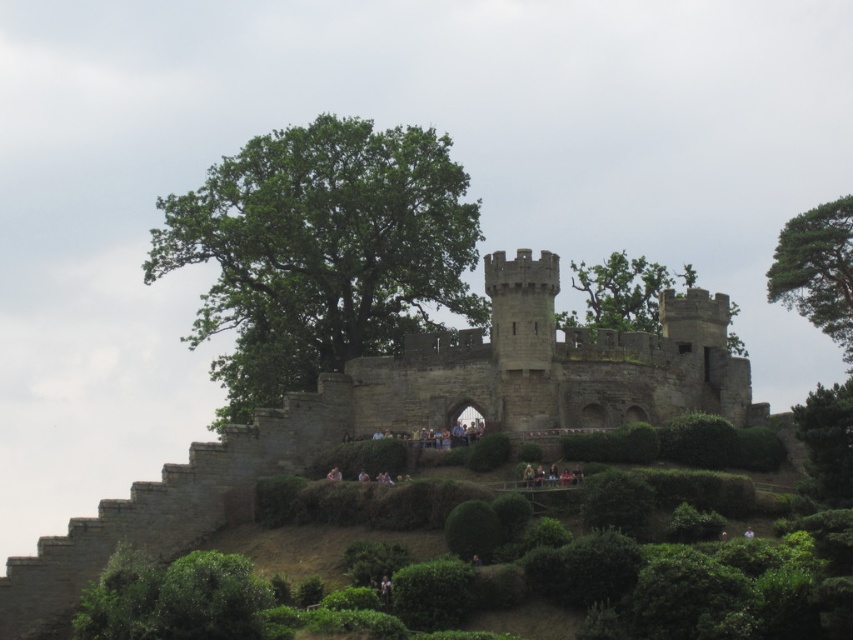
You are a tour guide explaining the castle grounds to visitors. You point out the green leafy tree at center and the green leafy tree at upper center. Which tree has a larger width according to the description?

The green leafy tree at center might be wider than the green leafy tree at upper center.

You are standing at the base of the castle and looking towards the entrance. You notice two trees in the distance. Which tree, the green textured pine tree at upper right or the green leafy tree at upper center, is positioned higher up on the hill?

The green textured pine tree at upper right is positioned higher up on the hill than the green leafy tree at upper center because it is located above it in the image.